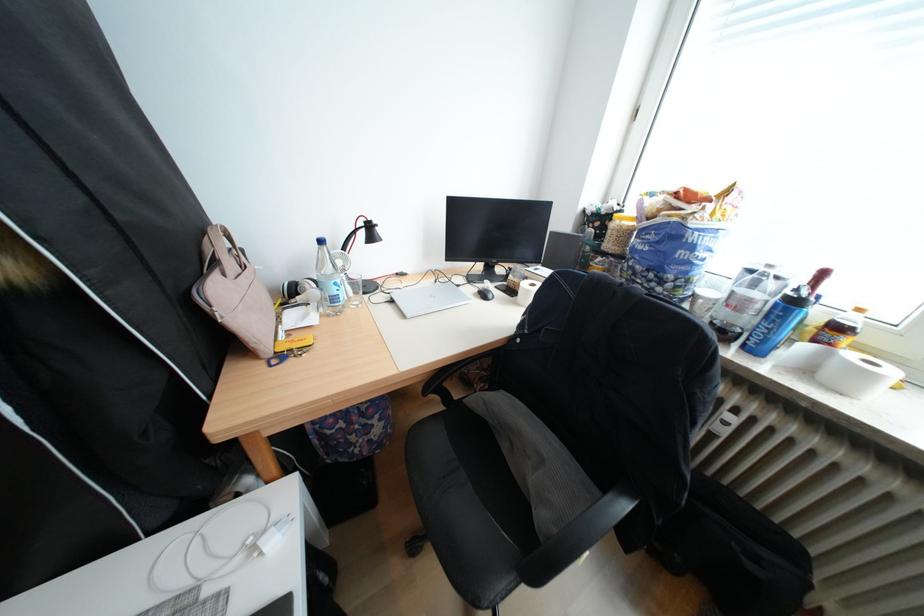
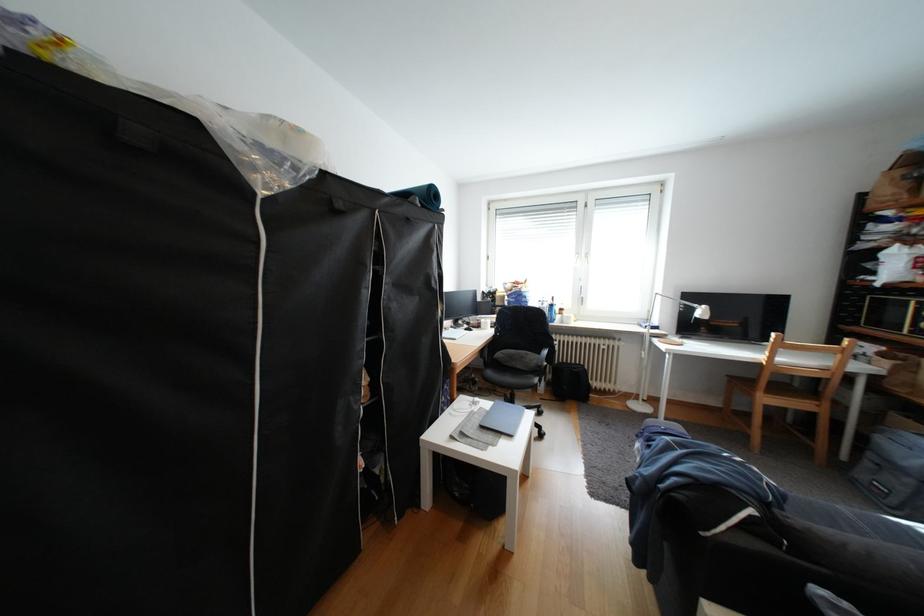
Question: I am providing you with two images of the same scene from different viewpoints. Which of the following objects are not visible in image2?

Choices:
 (A) black backpack
 (B) brown handbag
 (C) clear water bottle
 (D) black chair sitting surface

Answer: (C)